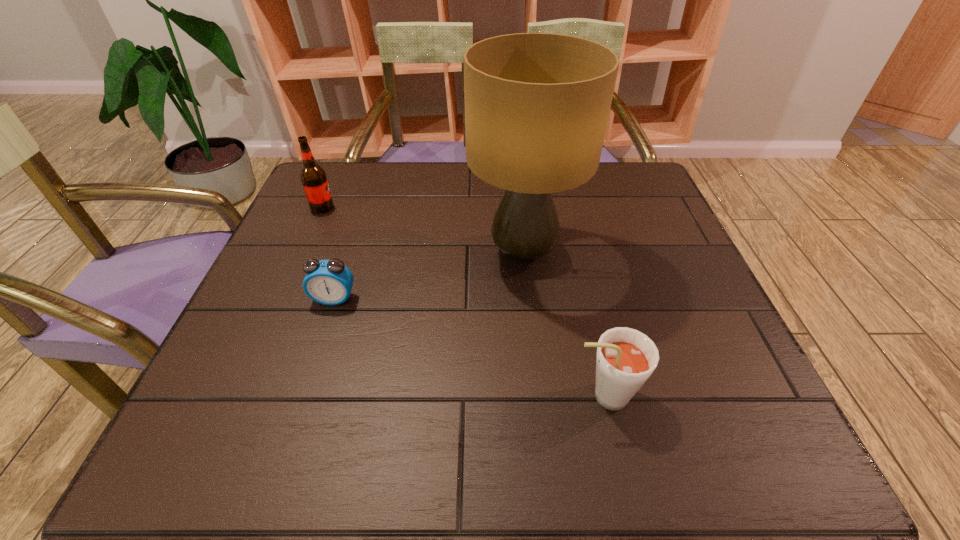
The height and width of the screenshot is (540, 960). What are the coordinates of `free space at the left edge of the desktop` in the screenshot? It's located at (286, 397).

The width and height of the screenshot is (960, 540). In order to click on vacant space at the right edge of the desktop in this screenshot , I will do click(658, 271).

The height and width of the screenshot is (540, 960). I want to click on free space at the far left corner of the desktop, so click(x=359, y=198).

Image resolution: width=960 pixels, height=540 pixels. In order to click on vacant region between the tallest object and the third tallest object in this screenshot , I will do `click(564, 324)`.

Locate an element on the screen. vacant space in between the alarm clock and the taller root beer is located at coordinates (328, 253).

The width and height of the screenshot is (960, 540). What are the coordinates of `vacant area that lies between the leftmost object and the tallest object` in the screenshot? It's located at (423, 230).

Where is `empty space that is in between the farther root beer and the nearest object`? The image size is (960, 540). empty space that is in between the farther root beer and the nearest object is located at coordinates [463, 302].

Where is `free space between the shorter root beer and the alarm clock`? Image resolution: width=960 pixels, height=540 pixels. free space between the shorter root beer and the alarm clock is located at coordinates (468, 347).

This screenshot has width=960, height=540. I want to click on free area in between the lampshade and the farthest object, so click(x=423, y=230).

Where is `free space between the tallest object and the third object from right to left`? free space between the tallest object and the third object from right to left is located at coordinates tap(429, 275).